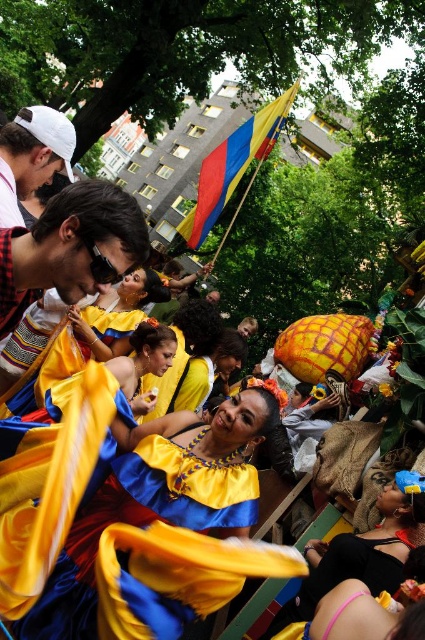
Question: Is the position of yellow and blue fabric flag at upper center more distant than that of white matte cap at upper left?

Choices:
 (A) yes
 (B) no

Answer: (A)

Question: Which object is farther from the camera taking this photo?

Choices:
 (A) black satin bikini at lower right
 (B) yellow and blue fabric flag at upper center
 (C) white matte cap at upper left

Answer: (B)

Question: Is shiny satin dress at center wider than black satin bikini at lower right?

Choices:
 (A) yes
 (B) no

Answer: (A)

Question: Considering the real-world distances, which object is closest to the white matte cap at upper left?

Choices:
 (A) shiny satin dress at center
 (B) black satin bikini at lower right

Answer: (A)

Question: Which point is farther to the camera?

Choices:
 (A) black satin bikini at lower right
 (B) white matte cap at upper left

Answer: (B)

Question: Can you confirm if shiny satin dress at center is positioned below yellow and blue fabric flag at upper center?

Choices:
 (A) no
 (B) yes

Answer: (B)